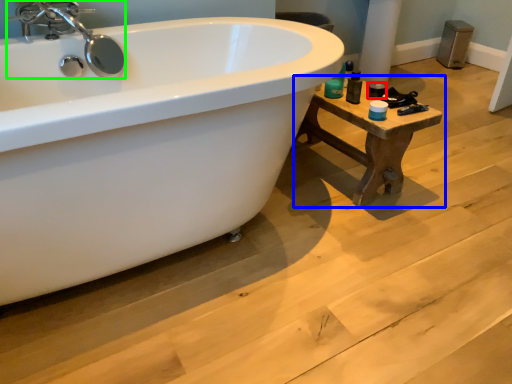
Question: Which object is positioned farthest from toiletry (highlighted by a red box)? Select from table (highlighted by a blue box) and tap (highlighted by a green box).

Choices:
 (A) table
 (B) tap

Answer: (B)